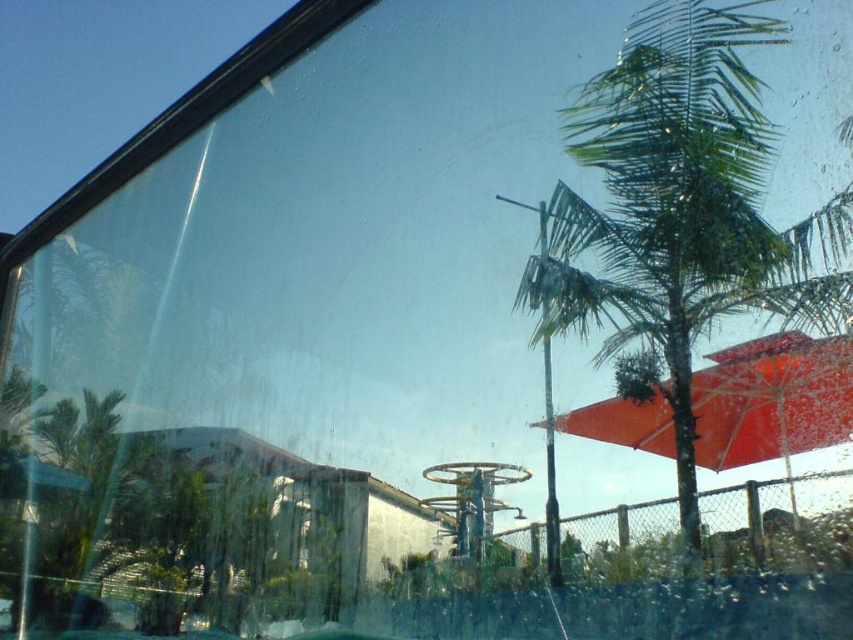
Question: Which point is farther to the camera?

Choices:
 (A) (740, 220)
 (B) (786, 340)

Answer: (B)

Question: Which point is closer to the camera taking this photo?

Choices:
 (A) (561, 257)
 (B) (839, 356)

Answer: (B)

Question: Does green leafy palm tree at right have a larger size compared to matte red umbrella at center right?

Choices:
 (A) yes
 (B) no

Answer: (A)

Question: Which object appears farthest from the camera in this image?

Choices:
 (A) green leafy palm tree at right
 (B) matte red umbrella at center right

Answer: (B)

Question: Can you confirm if green leafy palm tree at right is positioned above matte red umbrella at center right?

Choices:
 (A) yes
 (B) no

Answer: (A)

Question: Is the position of green leafy palm tree at right more distant than that of matte red umbrella at center right?

Choices:
 (A) yes
 (B) no

Answer: (B)